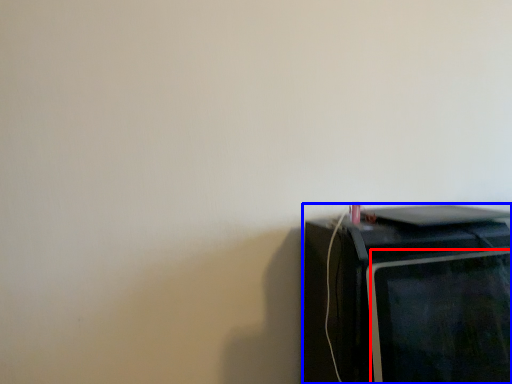
Question: Which object appears farthest to the camera in this image, computer monitor (highlighted by a red box) or home appliance (highlighted by a blue box)?

Choices:
 (A) computer monitor
 (B) home appliance

Answer: (B)